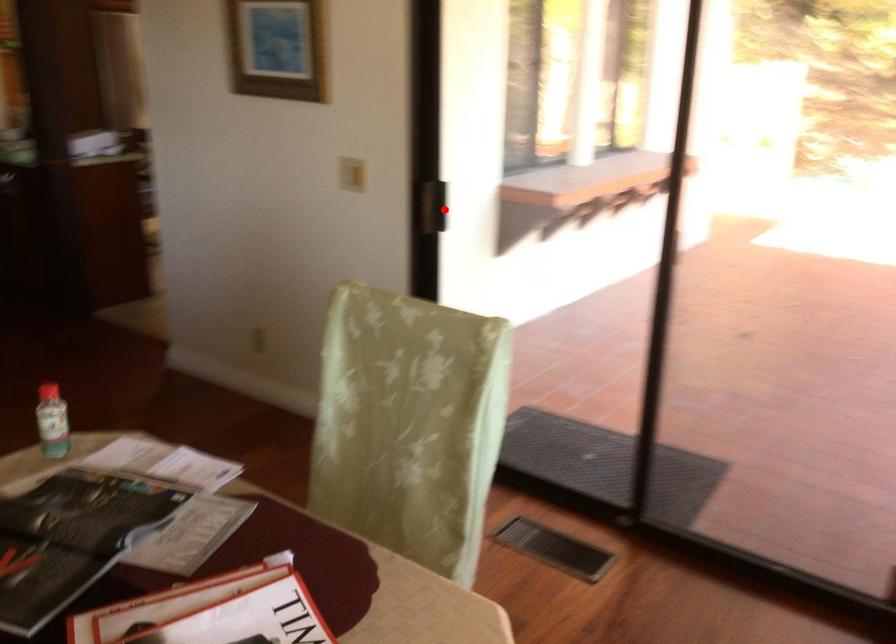
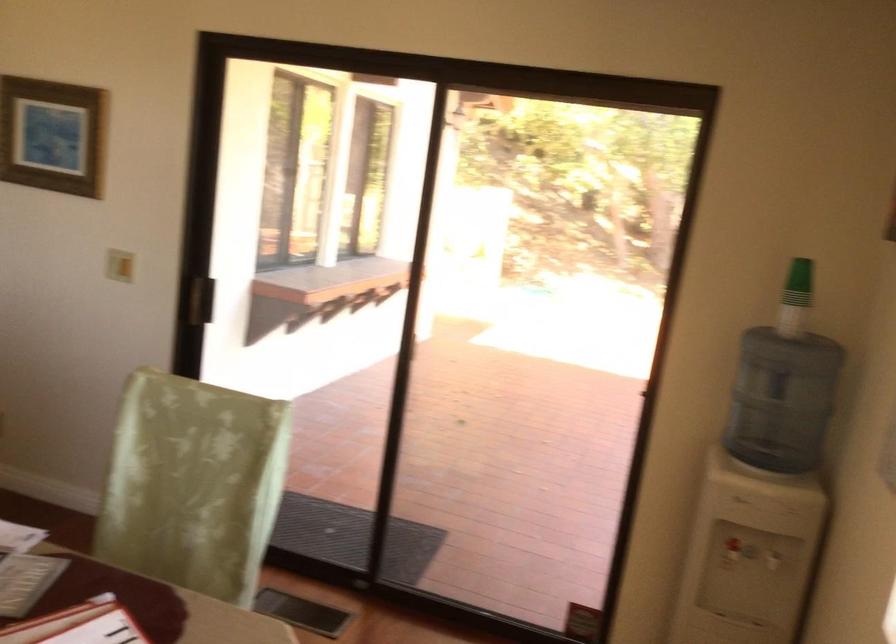
Find the pixel in the second image that matches the highlighted location in the first image.

(201, 299)